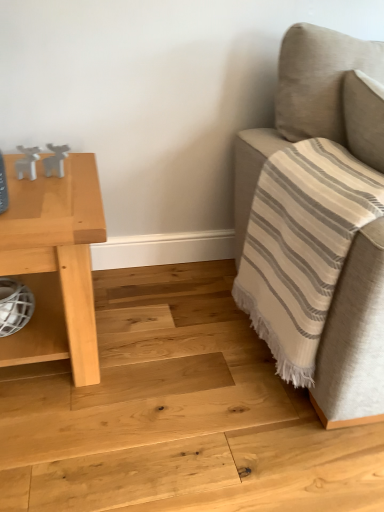
Question: Is white matte deer at upper left, the second toy positioned from the left, thinner than white mesh basket at lower left?

Choices:
 (A) yes
 (B) no

Answer: (A)

Question: From a real-world perspective, is white matte deer at upper left, the second toy positioned from the left, located beneath white mesh basket at lower left?

Choices:
 (A) yes
 (B) no

Answer: (B)

Question: Is white mesh basket at lower left located within white matte deer at upper left, the second toy positioned from the left?

Choices:
 (A) no
 (B) yes

Answer: (A)

Question: Is the depth of white matte deer at upper left, the second toy positioned from the left, greater than that of white mesh basket at lower left?

Choices:
 (A) no
 (B) yes

Answer: (B)

Question: Is white matte deer at upper left, the second toy positioned from the left, to the right of white mesh basket at lower left from the viewer's perspective?

Choices:
 (A) no
 (B) yes

Answer: (B)

Question: Can you confirm if white matte deer at upper left, the second toy positioned from the left, is bigger than white mesh basket at lower left?

Choices:
 (A) yes
 (B) no

Answer: (B)

Question: Is light wood table at left further to camera compared to white matte deer at upper left, which appears as the 1th toy when viewed from the right?

Choices:
 (A) yes
 (B) no

Answer: (B)

Question: Considering the relative sizes of light wood table at left and white matte deer at upper left, which appears as the 1th toy when viewed from the right, in the image provided, is light wood table at left thinner than white matte deer at upper left, which appears as the 1th toy when viewed from the right,?

Choices:
 (A) yes
 (B) no

Answer: (B)

Question: Can you confirm if light wood table at left is shorter than white matte deer at upper left, the second toy positioned from the left?

Choices:
 (A) no
 (B) yes

Answer: (A)

Question: Does light wood table at left turn towards white matte deer at upper left, which appears as the 1th toy when viewed from the right?

Choices:
 (A) no
 (B) yes

Answer: (A)

Question: Is light wood table at left touching white matte deer at upper left, which appears as the 1th toy when viewed from the right?

Choices:
 (A) yes
 (B) no

Answer: (B)

Question: Is light wood table at left to the right of white matte deer at upper left, which appears as the 1th toy when viewed from the right, from the viewer's perspective?

Choices:
 (A) yes
 (B) no

Answer: (B)

Question: Could you tell me if white matte deer at left, positioned as the first toy in left-to-right order, is turned towards white matte deer at upper left, which appears as the 1th toy when viewed from the right?

Choices:
 (A) yes
 (B) no

Answer: (B)